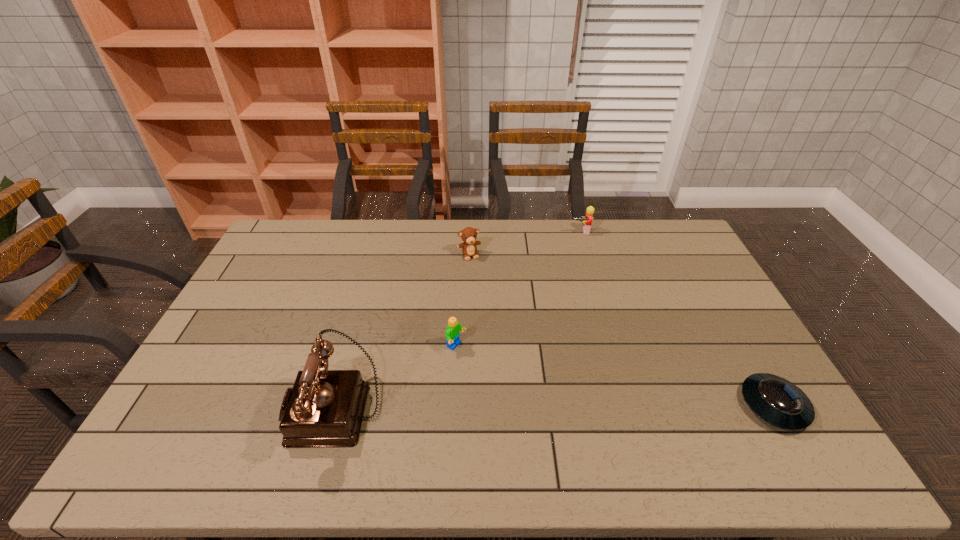
At what (x,y) coordinates should I click in order to perform the action: click on free space located on the dial of the leftmost object. Please return your answer as a coordinate pair (x, y). The image size is (960, 540). Looking at the image, I should click on (253, 408).

Find the location of a particular element. This screenshot has height=540, width=960. vacant space located 0.280m on the dial of the leftmost object is located at coordinates (180, 408).

Locate an element on the screen. The image size is (960, 540). vacant region located on the left of the shortest object is located at coordinates (641, 406).

This screenshot has height=540, width=960. What are the coordinates of `free space located on the face of the teddy bear` in the screenshot? It's located at (476, 271).

Identify the location of vacant space located 0.140m on the face of the teddy bear. (483, 286).

Locate an element on the screen. vacant space situated on the face of the teddy bear is located at coordinates (x=484, y=290).

I want to click on vacant space located 0.270m on the face of the nearer Lego, so [544, 401].

Find the location of a particular element. The image size is (960, 540). free location located 0.340m on the face of the nearer Lego is located at coordinates (567, 415).

I want to click on vacant space located on the face of the nearer Lego, so click(x=578, y=422).

What are the coordinates of `free space located in front of the fourth object from left to right with the accessory visible` in the screenshot? It's located at (586, 267).